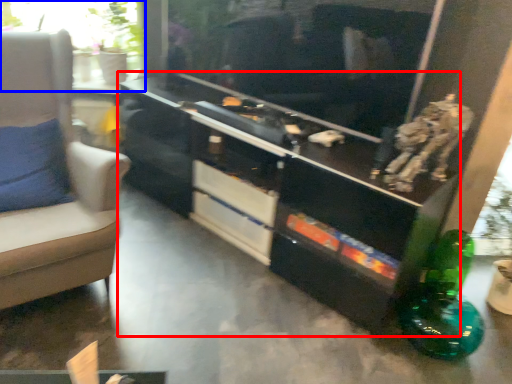
Question: Among these objects, which one is farthest to the camera, entertainment center (highlighted by a red box) or window (highlighted by a blue box)?

Choices:
 (A) entertainment center
 (B) window

Answer: (B)